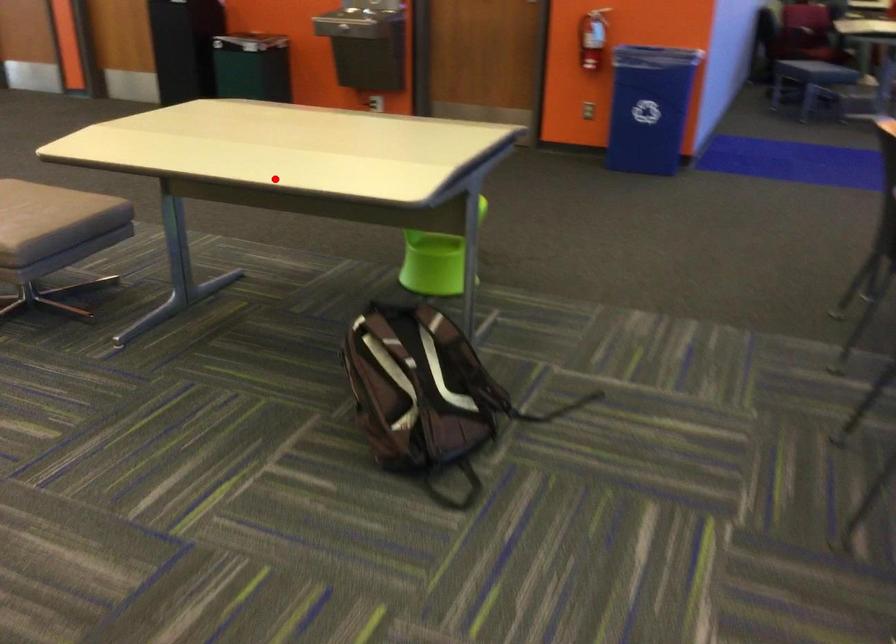
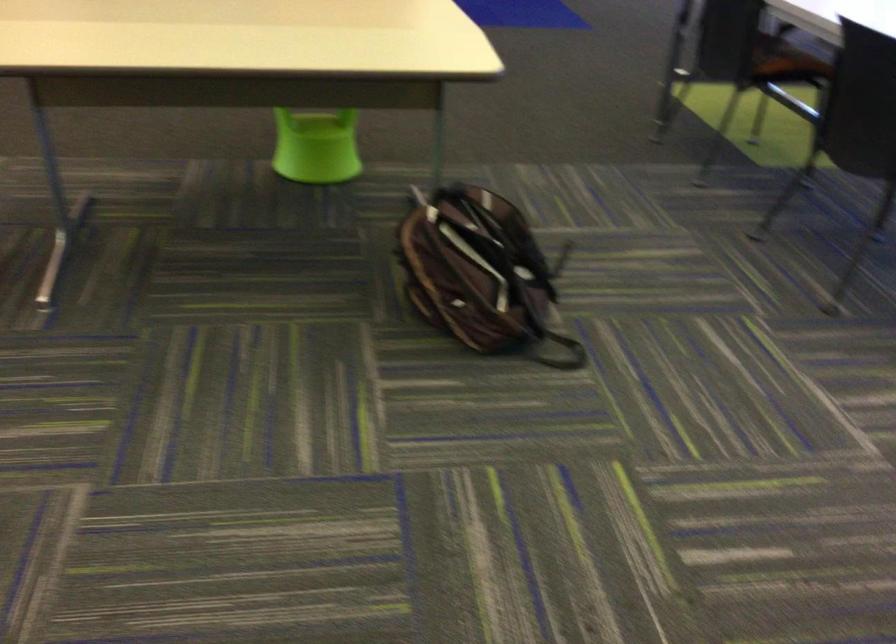
Question: A red point is marked in image1. In image2, is the corresponding 3D point closer to the camera or farther? Reply with the corresponding letter.

Choices:
 (A) The corresponding 3D point is closer.
 (B) The corresponding 3D point is farther.

Answer: (A)